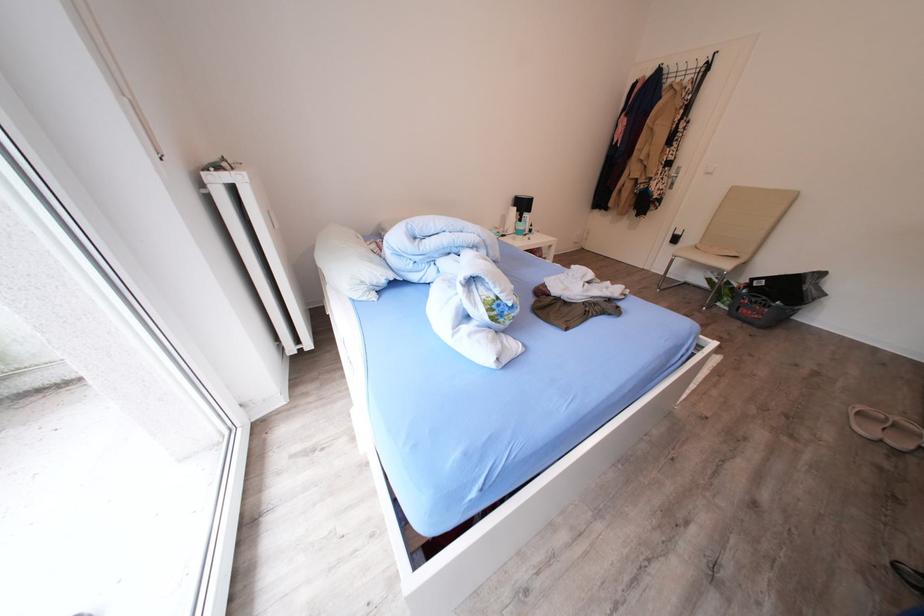
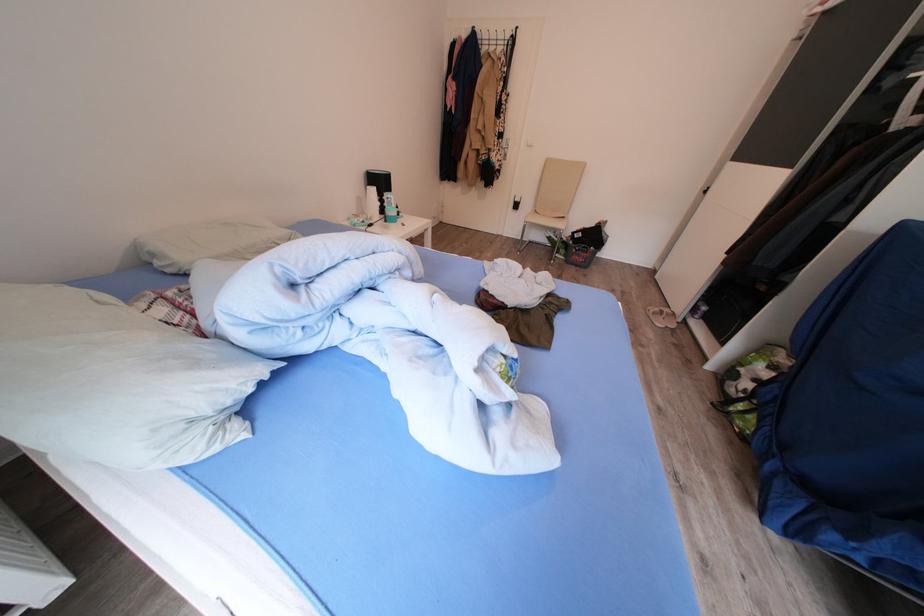
Question: Based on the continuous images, in which direction is the camera rotating? Reply with the corresponding letter.

Choices:
 (A) Left
 (B) Right
 (C) Up
 (D) Down

Answer: (B)